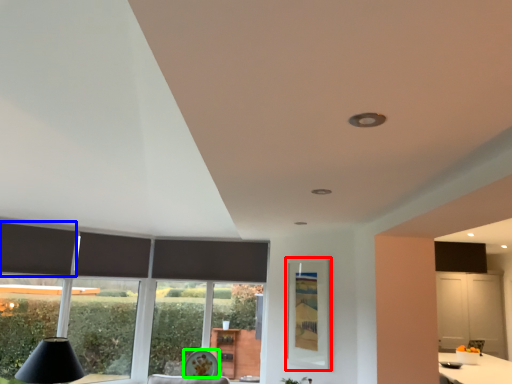
Question: Which object is positioned farthest from window screen (highlighted by a red box)? Select from curtain (highlighted by a blue box) and round table (highlighted by a green box).

Choices:
 (A) curtain
 (B) round table

Answer: (A)